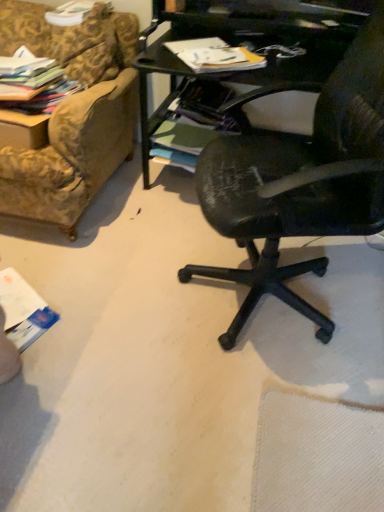
Question: Does matte paper magazine at upper center, which ranks as the 2th magazine in left-to-right order, have a greater height compared to gold-patterned fabric couch at upper left?

Choices:
 (A) no
 (B) yes

Answer: (A)

Question: Is gold-patterned fabric couch at upper left at the back of matte paper magazine at upper center, the first magazine when ordered from right to left?

Choices:
 (A) yes
 (B) no

Answer: (B)

Question: From a real-world perspective, is matte paper magazine at upper center, which ranks as the 2th magazine in left-to-right order, located beneath gold-patterned fabric couch at upper left?

Choices:
 (A) yes
 (B) no

Answer: (B)

Question: Are matte paper magazine at upper center, the first magazine when ordered from right to left, and gold-patterned fabric couch at upper left beside each other?

Choices:
 (A) no
 (B) yes

Answer: (A)

Question: Is gold-patterned fabric couch at upper left completely or partially inside matte paper magazine at upper center, which ranks as the 2th magazine in left-to-right order?

Choices:
 (A) yes
 (B) no

Answer: (B)

Question: Can you confirm if matte paper magazine at upper center, the first magazine when ordered from right to left, is smaller than gold-patterned fabric couch at upper left?

Choices:
 (A) yes
 (B) no

Answer: (A)

Question: Is multicolored fabric stack at upper left, the 2th magazine when ordered from right to left, further to the viewer compared to matte paper magazine at upper center, which ranks as the 2th magazine in left-to-right order?

Choices:
 (A) no
 (B) yes

Answer: (B)

Question: Can you confirm if multicolored fabric stack at upper left, the 2th magazine when ordered from right to left, is thinner than matte paper magazine at upper center, the first magazine when ordered from right to left?

Choices:
 (A) yes
 (B) no

Answer: (B)

Question: Considering the relative positions of multicolored fabric stack at upper left, the 2th magazine when ordered from right to left, and matte paper magazine at upper center, which ranks as the 2th magazine in left-to-right order, in the image provided, is multicolored fabric stack at upper left, the 2th magazine when ordered from right to left, to the right of matte paper magazine at upper center, which ranks as the 2th magazine in left-to-right order, from the viewer's perspective?

Choices:
 (A) no
 (B) yes

Answer: (A)

Question: Is multicolored fabric stack at upper left, the 2th magazine when ordered from right to left, in front of matte paper magazine at upper center, which ranks as the 2th magazine in left-to-right order?

Choices:
 (A) yes
 (B) no

Answer: (B)

Question: Is multicolored fabric stack at upper left, the 2th magazine when ordered from right to left, positioned with its back to matte paper magazine at upper center, which ranks as the 2th magazine in left-to-right order?

Choices:
 (A) no
 (B) yes

Answer: (A)

Question: From a real-world perspective, is multicolored fabric stack at upper left, the first magazine viewed from the left, physically below matte paper magazine at upper center, which ranks as the 2th magazine in left-to-right order?

Choices:
 (A) no
 (B) yes

Answer: (B)

Question: Is the position of multicolored fabric stack at upper left, the 2th magazine when ordered from right to left, less distant than that of gold-patterned fabric couch at upper left?

Choices:
 (A) no
 (B) yes

Answer: (B)